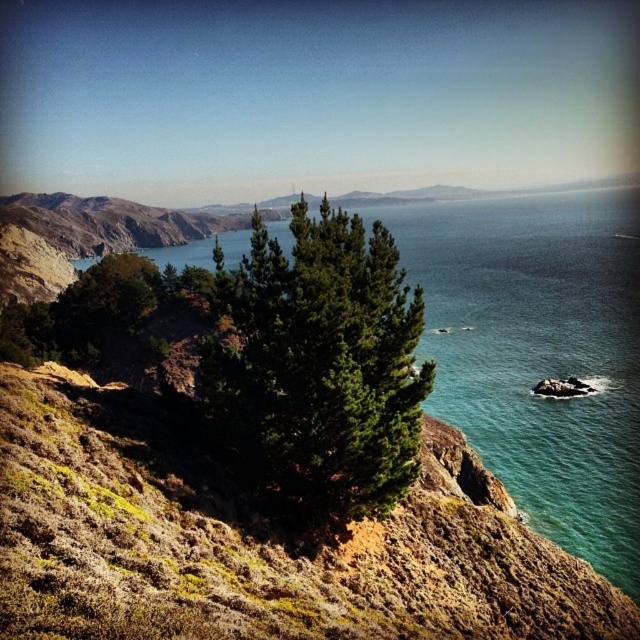
What do you see at coordinates (540, 353) in the screenshot?
I see `greenish-blue water at center` at bounding box center [540, 353].

Between greenish-blue water at center and green textured tree at center, which one is positioned lower?

green textured tree at center

Does point (460, 349) lie in front of point (230, 285)?

No, it is not.

Image resolution: width=640 pixels, height=640 pixels. What are the coordinates of `greenish-blue water at center` in the screenshot? It's located at (540, 353).